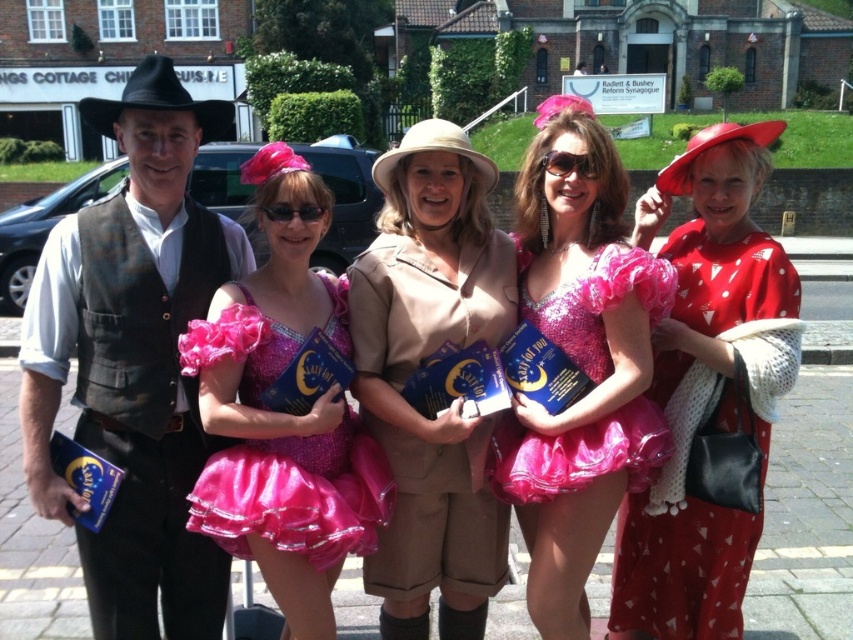
Between red satin dress at center and pink sequined dress at center, which one is positioned lower?

pink sequined dress at center is lower down.

Where is `red satin dress at center`? This screenshot has width=853, height=640. red satin dress at center is located at coordinates (706, 387).

Looking at this image, can you confirm if beige fabric dress at center is positioned to the left of sparkly pink dress at center?

Correct, you'll find beige fabric dress at center to the left of sparkly pink dress at center.

Does point (381, 232) lie in front of point (540, 467)?

No, it is behind (540, 467).

The height and width of the screenshot is (640, 853). Identify the location of beige fabric dress at center. (421, 433).

Is point (193, 467) farther from camera compared to point (286, 483)?

Yes, point (193, 467) is behind point (286, 483).

Based on the photo, can you confirm if brown leather vest at left is taller than pink sequined dress at center?

Yes.

Locate an element on the screen. brown leather vest at left is located at coordinates (134, 362).